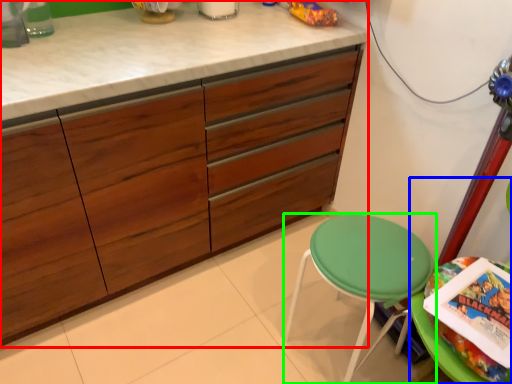
Question: Which is farther away from cabinetry (highlighted by a red box)? swivel chair (highlighted by a blue box) or stool (highlighted by a green box)?

Choices:
 (A) swivel chair
 (B) stool

Answer: (A)